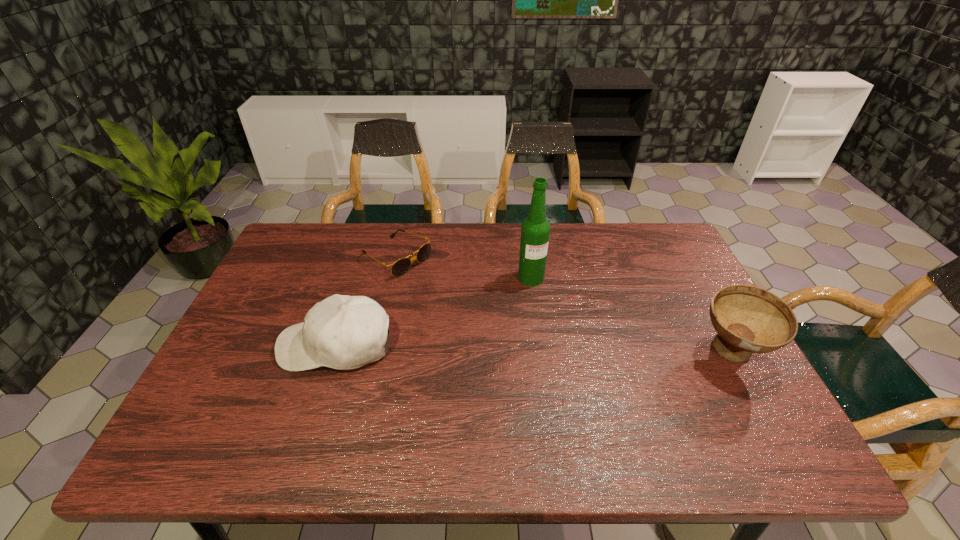
Identify the location of baseball cap. (342, 332).

The height and width of the screenshot is (540, 960). What are the coordinates of `soup bowl` in the screenshot? It's located at (748, 319).

Where is `the tallest object`? The height and width of the screenshot is (540, 960). the tallest object is located at coordinates (535, 230).

What are the coordinates of `the second object from right to left` in the screenshot? It's located at (535, 230).

I want to click on the shortest object, so click(400, 267).

You are a GUI agent. You are given a task and a screenshot of the screen. Output one action in this format:
    pyautogui.click(x=<x>, y=<y>)
    Task: Click on the vacant space situated 0.130m on the front-facing side of the baseball cap
    
    Given the screenshot: What is the action you would take?
    pyautogui.click(x=229, y=345)

Image resolution: width=960 pixels, height=540 pixels. I want to click on free spot located on the front-facing side of the baseball cap, so click(229, 345).

You are a GUI agent. You are given a task and a screenshot of the screen. Output one action in this format:
    pyautogui.click(x=<x>, y=<y>)
    Task: Click on the free space located on the front-facing side of the baseball cap
    
    Given the screenshot: What is the action you would take?
    pyautogui.click(x=245, y=345)

I want to click on free space located on the left of the soup bowl, so click(626, 353).

The height and width of the screenshot is (540, 960). What are the coordinates of `free space located on the label of the second object from right to left` in the screenshot? It's located at (542, 298).